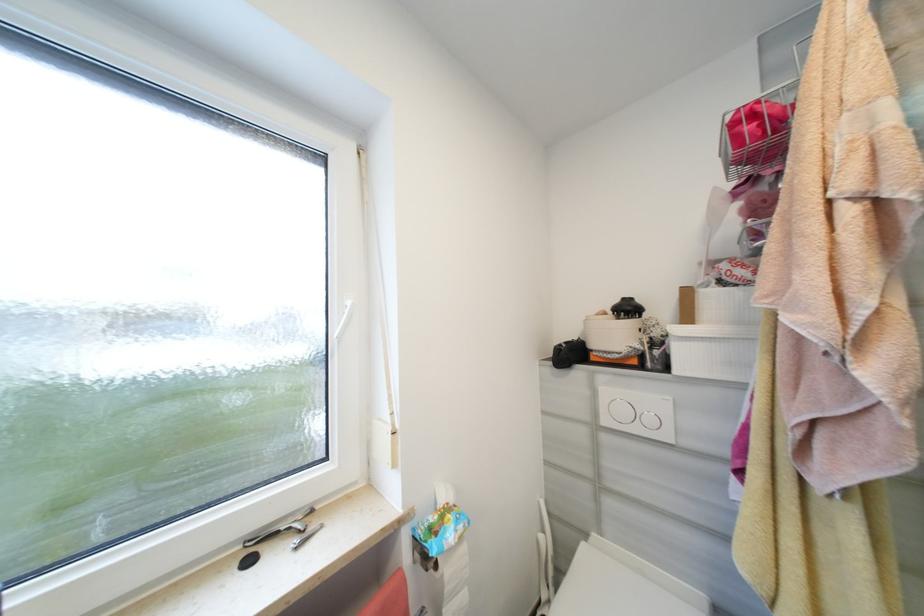
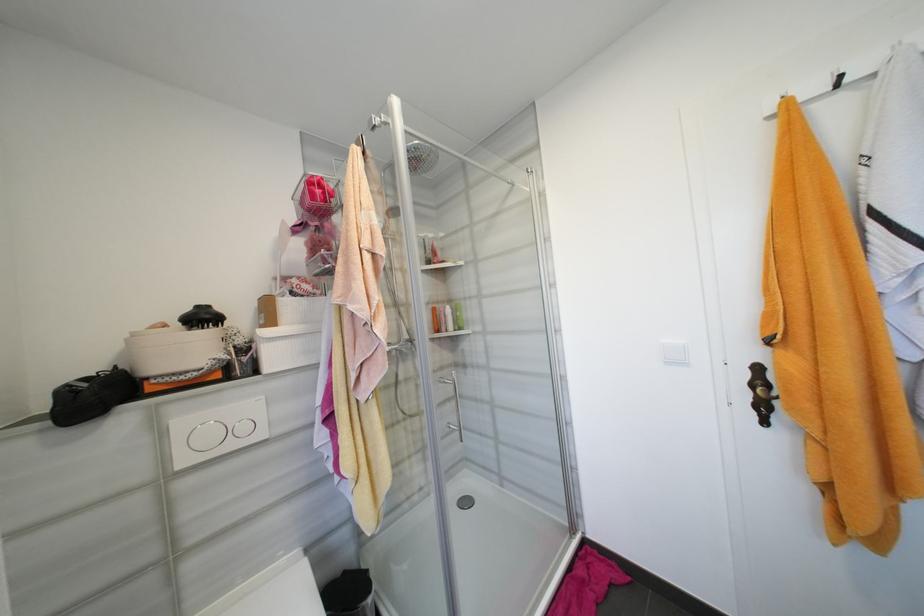
In the second image, find the point that corresponds to point (655, 421) in the first image.

(249, 429)